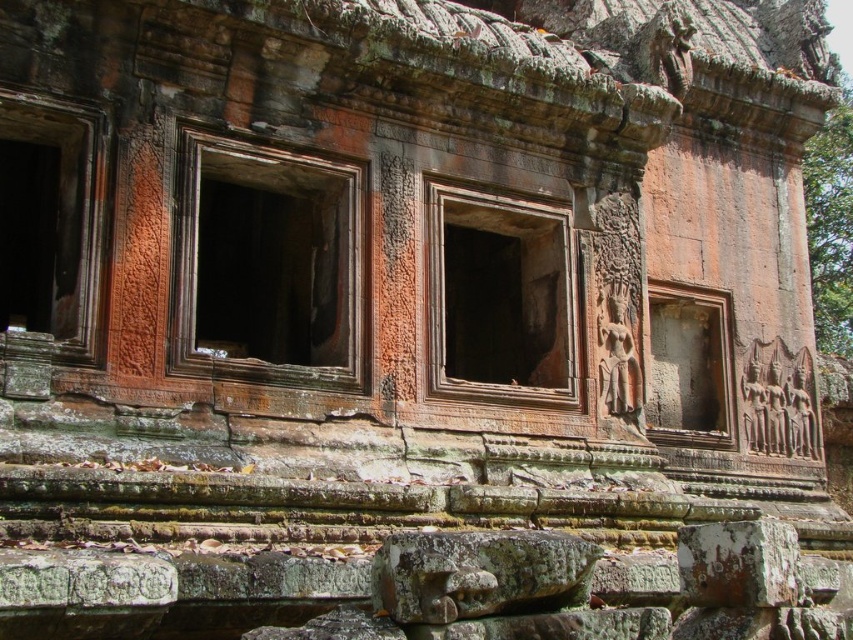
Which of these two, brown stone window at left or carved stone relief at center, stands shorter?

Standing shorter between the two is carved stone relief at center.

Does brown stone window at left come in front of carved stone relief at center?

Yes, brown stone window at left is closer to the viewer.

Find the location of a particular element. The height and width of the screenshot is (640, 853). brown stone window at left is located at coordinates (50, 220).

Consider the image. Between brown stone window at center and brown stone window at left, which one is positioned higher?

brown stone window at left is above.

Who is more distant from viewer, (281, 198) or (27, 138)?

Positioned behind is point (281, 198).

Find the location of a particular element. This screenshot has width=853, height=640. brown stone window at center is located at coordinates (267, 266).

The height and width of the screenshot is (640, 853). I want to click on brown stone window at center, so click(267, 266).

Can you confirm if brown stone window at center is thinner than rustic stone window at center?

In fact, brown stone window at center might be wider than rustic stone window at center.

Which is more to the left, brown stone window at center or rustic stone window at center?

brown stone window at center is more to the left.

Which is in front, point (180, 173) or point (503, 241)?

Positioned in front is point (180, 173).

At what (x,y) coordinates should I click in order to perform the action: click on brown stone window at center. Please return your answer as a coordinate pair (x, y). The width and height of the screenshot is (853, 640). Looking at the image, I should click on (267, 266).